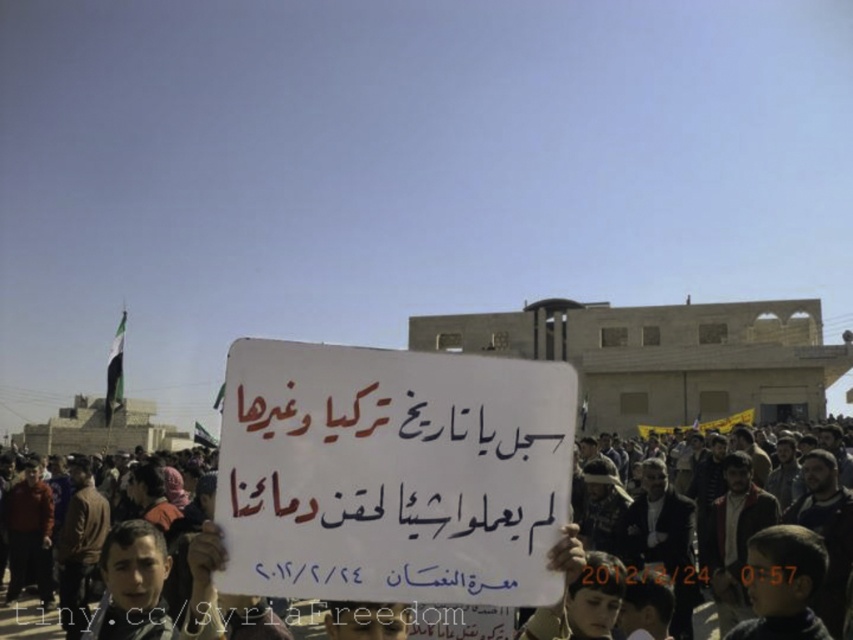
Question: Which object appears closest to the camera in this image?

Choices:
 (A) dark brown leather jacket at center
 (B) white paper sign at center

Answer: (B)

Question: Does white paper sign at center have a lesser width compared to dark brown leather jacket at center?

Choices:
 (A) no
 (B) yes

Answer: (B)

Question: Can you confirm if white paper sign at center is wider than dark brown leather jacket at center?

Choices:
 (A) yes
 (B) no

Answer: (B)

Question: Can you confirm if white paper sign at center is positioned to the right of dark brown leather jacket at center?

Choices:
 (A) yes
 (B) no

Answer: (B)

Question: Which object is closer to the camera taking this photo?

Choices:
 (A) white paper sign at center
 (B) dark brown leather jacket at center

Answer: (A)

Question: Which point is closer to the camera taking this photo?

Choices:
 (A) (315, 435)
 (B) (741, 449)

Answer: (A)